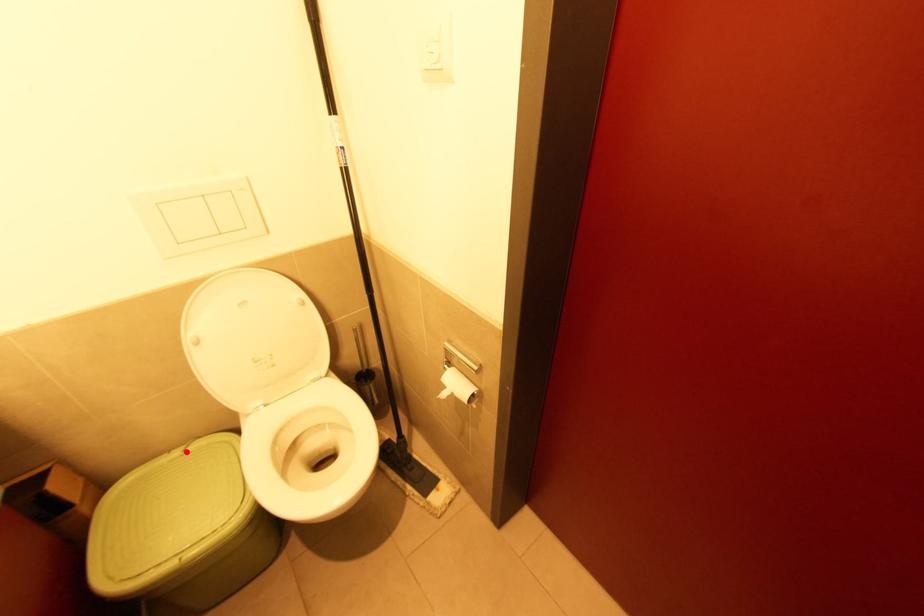
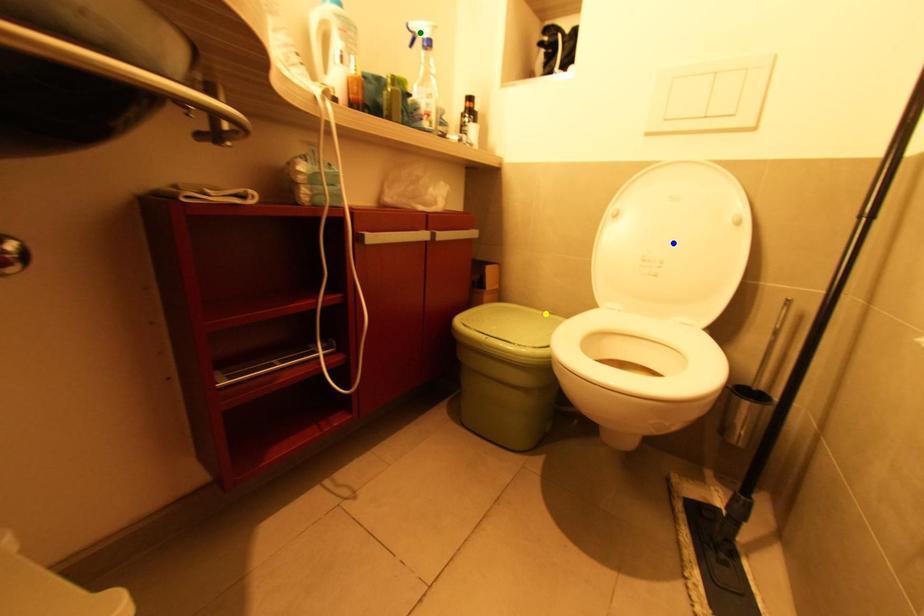
Question: I am providing you with two images of the same scene from different viewpoints. A red point is marked on the first image. You are given multiple points on the second image. Which spot in image 2 lines up with the point in image 1?

Choices:
 (A) green point
 (B) blue point
 (C) yellow point

Answer: (C)